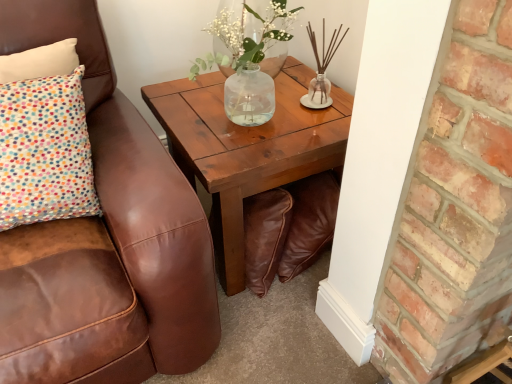
Question: Is translucent glass vase at upper center in contact with wooden coffee table at center?

Choices:
 (A) yes
 (B) no

Answer: (B)

Question: From the image's perspective, is translucent glass vase at upper center below wooden coffee table at center?

Choices:
 (A) no
 (B) yes

Answer: (A)

Question: Does translucent glass vase at upper center contain wooden coffee table at center?

Choices:
 (A) no
 (B) yes

Answer: (A)

Question: Considering the relative positions of translucent glass vase at upper center and wooden coffee table at center in the image provided, is translucent glass vase at upper center in front of wooden coffee table at center?

Choices:
 (A) no
 (B) yes

Answer: (A)

Question: From the image's perspective, is translucent glass vase at upper center located above wooden coffee table at center?

Choices:
 (A) yes
 (B) no

Answer: (A)

Question: Is translucent glass vase at upper center to the right of wooden coffee table at center from the viewer's perspective?

Choices:
 (A) yes
 (B) no

Answer: (B)

Question: From a real-world perspective, is wooden coffee table at center on top of translucent glass vase at upper center?

Choices:
 (A) yes
 (B) no

Answer: (B)

Question: Can you confirm if wooden coffee table at center is thinner than translucent glass vase at upper center?

Choices:
 (A) yes
 (B) no

Answer: (B)

Question: Does wooden coffee table at center have a smaller size compared to translucent glass vase at upper center?

Choices:
 (A) yes
 (B) no

Answer: (B)

Question: Considering the relative positions of wooden coffee table at center and translucent glass vase at upper center in the image provided, is wooden coffee table at center behind translucent glass vase at upper center?

Choices:
 (A) yes
 (B) no

Answer: (B)

Question: Does wooden coffee table at center appear on the left side of translucent glass vase at upper center?

Choices:
 (A) yes
 (B) no

Answer: (B)

Question: Is wooden coffee table at center far away from translucent glass vase at upper center?

Choices:
 (A) yes
 (B) no

Answer: (B)

Question: Looking at their shapes, would you say wooden coffee table at center is wider or thinner than translucent glass vase at upper center?

Choices:
 (A) thin
 (B) wide

Answer: (B)